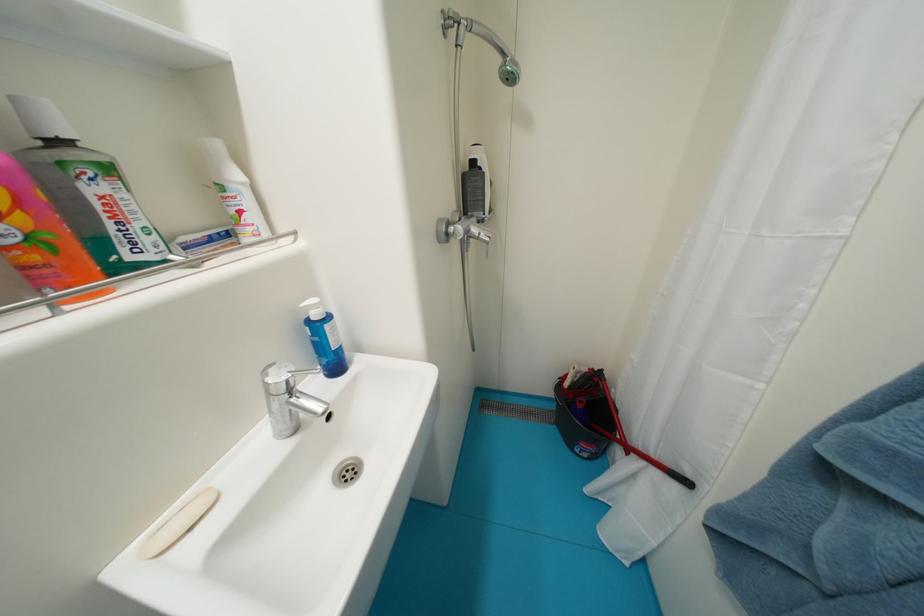
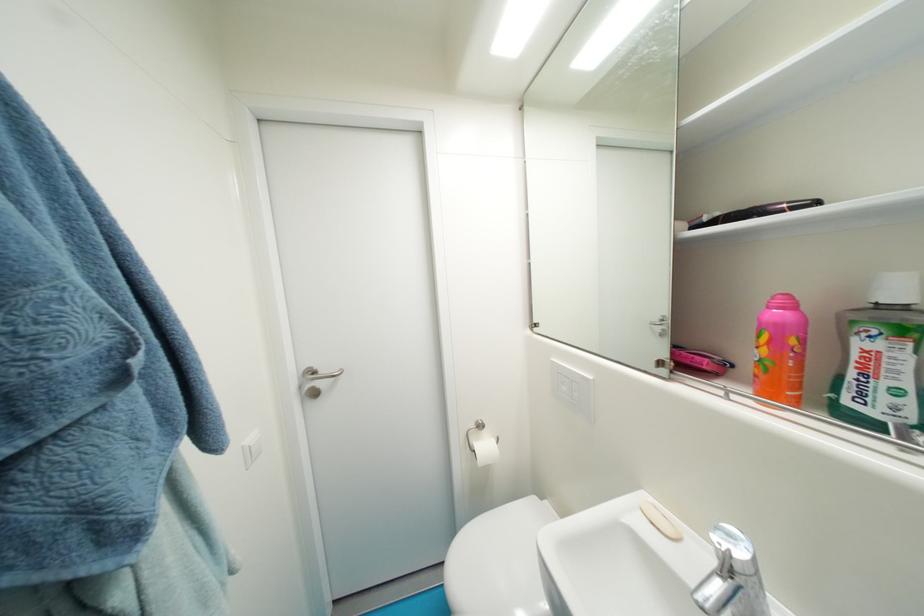
Locate, in the second image, the point that corresponds to the point at 117,227 in the first image.

(858, 376)